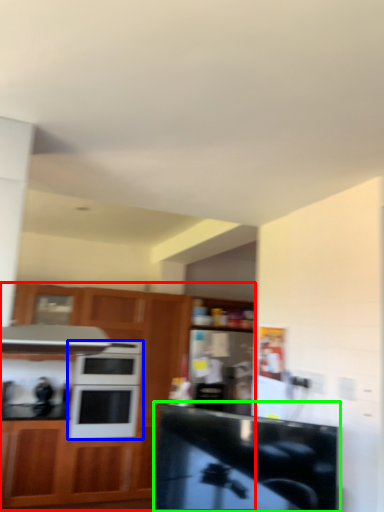
Question: Which object is the farthest from cabinetry (highlighted by a red box)? Choose among these: microwave oven (highlighted by a blue box) or counter top (highlighted by a green box).

Choices:
 (A) microwave oven
 (B) counter top

Answer: (B)